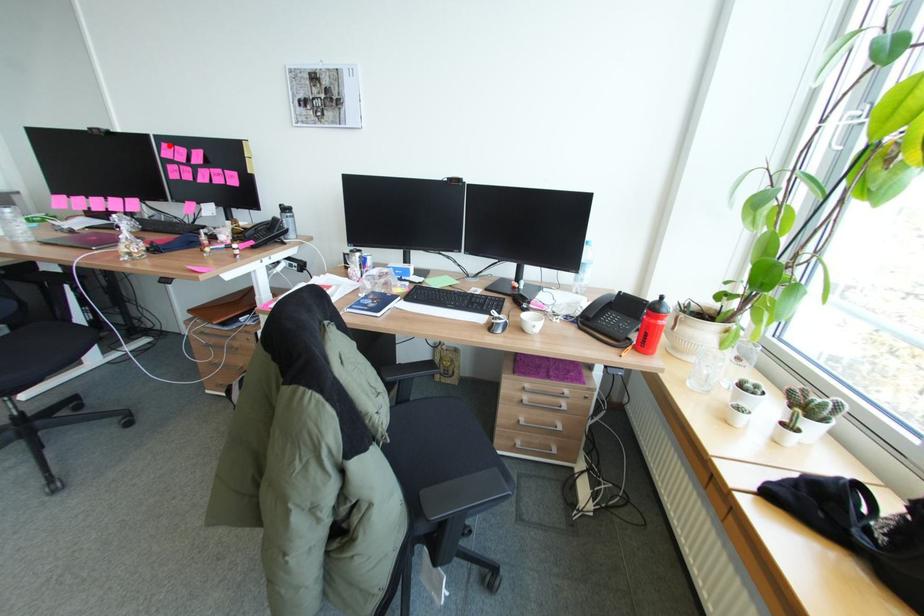
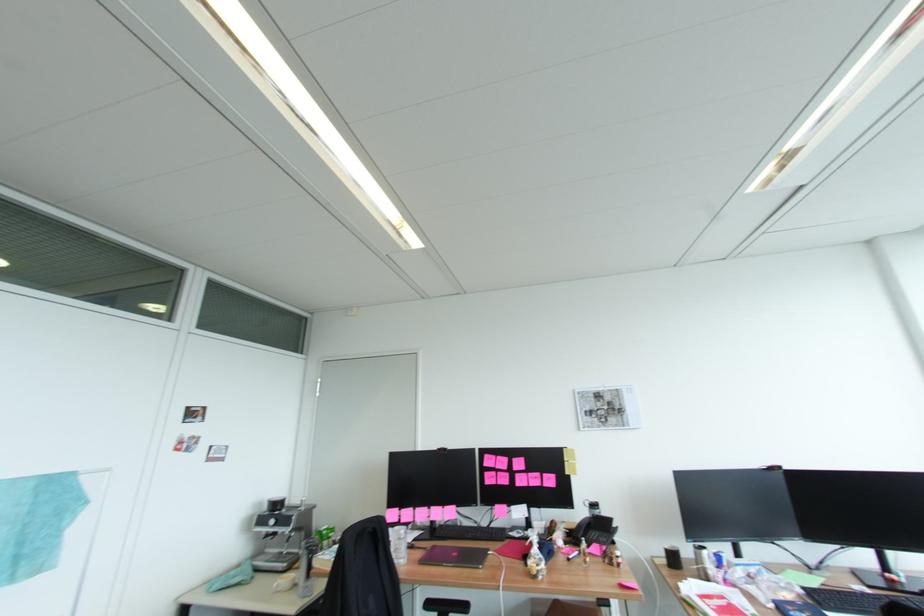
Where in the second image is the point corresponding to the highlighted location from the first image?

(492, 456)